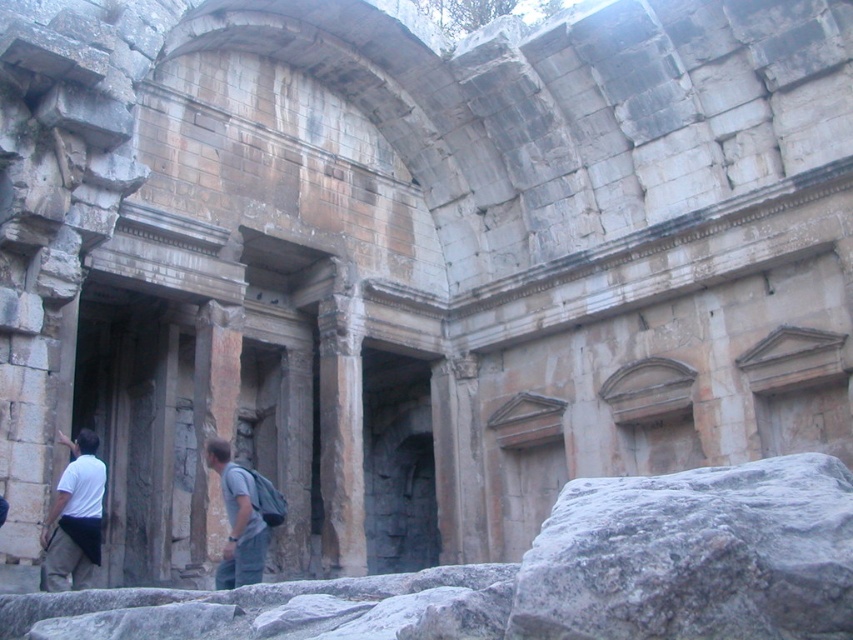
Is point (57, 490) positioned in front of point (257, 552)?

Yes, point (57, 490) is in front of point (257, 552).

Is white fabric backpack at lower left to the right of gray fabric backpack at lower center from the viewer's perspective?

In fact, white fabric backpack at lower left is to the left of gray fabric backpack at lower center.

The height and width of the screenshot is (640, 853). What are the coordinates of `white fabric backpack at lower left` in the screenshot? It's located at (74, 518).

Can you confirm if white cotton shirt at lower left is smaller than gray fabric backpack at lower center?

Incorrect, white cotton shirt at lower left is not smaller in size than gray fabric backpack at lower center.

The height and width of the screenshot is (640, 853). What are the coordinates of `white cotton shirt at lower left` in the screenshot? It's located at (74, 518).

Can you confirm if white fabric backpack at lower left is smaller than white cotton shirt at lower left?

Incorrect, white fabric backpack at lower left is not smaller in size than white cotton shirt at lower left.

Is white fabric backpack at lower left above white cotton shirt at lower left?

Actually, white fabric backpack at lower left is below white cotton shirt at lower left.

This screenshot has width=853, height=640. In order to click on white fabric backpack at lower left in this screenshot , I will do `click(74, 518)`.